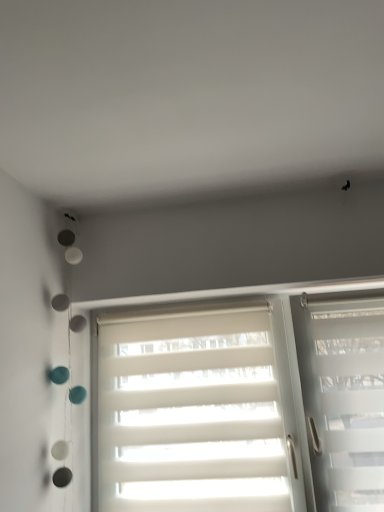
Question: Which direction should I rotate to look at white matte blinds at center, marked as the 2th window in a right-to-left arrangement, — up or down?

Choices:
 (A) up
 (B) down

Answer: (B)

Question: Can you confirm if white matte blinds at center, marked as the 2th window in a right-to-left arrangement, is taller than transparent plastic window at right, the second window in the left-to-right sequence?

Choices:
 (A) no
 (B) yes

Answer: (A)

Question: Can we say white matte blinds at center, the 1th window from the left, lies outside transparent plastic window at right, the first window when ordered from right to left?

Choices:
 (A) no
 (B) yes

Answer: (B)

Question: From a real-world perspective, is white matte blinds at center, the 1th window from the left, on transparent plastic window at right, the second window in the left-to-right sequence?

Choices:
 (A) yes
 (B) no

Answer: (A)

Question: Does white matte blinds at center, the 1th window from the left, have a greater width compared to transparent plastic window at right, the first window when ordered from right to left?

Choices:
 (A) no
 (B) yes

Answer: (A)

Question: Considering the relative positions of white matte blinds at center, the 1th window from the left, and transparent plastic window at right, the first window when ordered from right to left, in the image provided, is white matte blinds at center, the 1th window from the left, to the right of transparent plastic window at right, the first window when ordered from right to left, from the viewer's perspective?

Choices:
 (A) no
 (B) yes

Answer: (A)

Question: Is white matte blinds at center, marked as the 2th window in a right-to-left arrangement, positioned with its back to transparent plastic window at right, the first window when ordered from right to left?

Choices:
 (A) yes
 (B) no

Answer: (B)

Question: Is transparent plastic window at right, the second window in the left-to-right sequence, to the left of white matte blinds at center, the 1th window from the left, from the viewer's perspective?

Choices:
 (A) no
 (B) yes

Answer: (A)

Question: Is transparent plastic window at right, the first window when ordered from right to left, to the right of white matte blinds at center, marked as the 2th window in a right-to-left arrangement, from the viewer's perspective?

Choices:
 (A) yes
 (B) no

Answer: (A)

Question: Is white matte blinds at center, the 1th window from the left, surrounded by transparent plastic window at right, the second window in the left-to-right sequence?

Choices:
 (A) no
 (B) yes

Answer: (A)

Question: Does transparent plastic window at right, the first window when ordered from right to left, have a larger size compared to white matte blinds at center, the 1th window from the left?

Choices:
 (A) yes
 (B) no

Answer: (A)

Question: Is transparent plastic window at right, the second window in the left-to-right sequence, not near white matte blinds at center, the 1th window from the left?

Choices:
 (A) no
 (B) yes

Answer: (A)

Question: From the image's perspective, does transparent plastic window at right, the second window in the left-to-right sequence, appear lower than white matte blinds at center, the 1th window from the left?

Choices:
 (A) yes
 (B) no

Answer: (B)

Question: Is transparent plastic window at right, the second window in the left-to-right sequence, taller or shorter than white matte blinds at center, marked as the 2th window in a right-to-left arrangement?

Choices:
 (A) tall
 (B) short

Answer: (A)